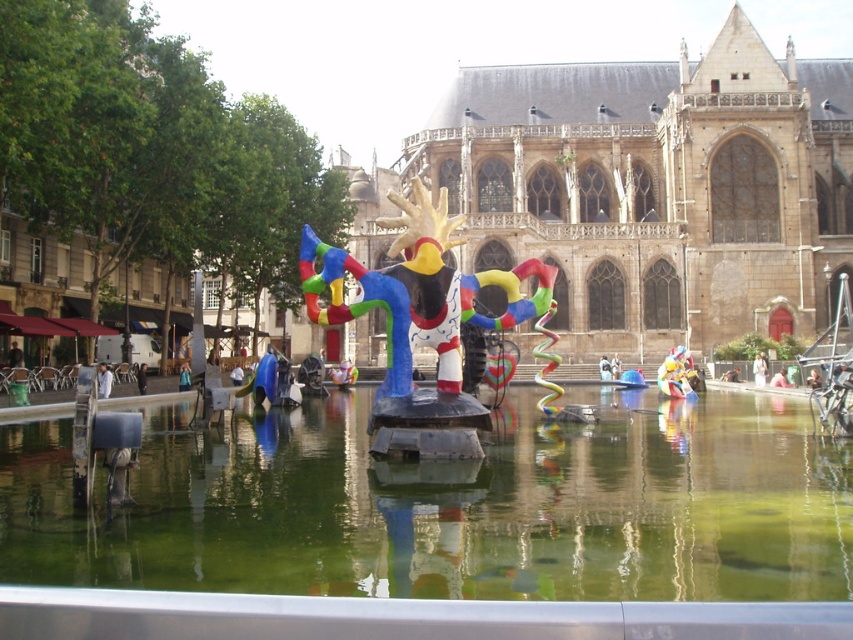
You are an artist planning to create a miniature version of the multicolored plastic sculpture at center and the multicolored plastic toy at center. If the toy is 10 cm tall, what should be the minimum height of the sculpture to maintain the correct proportions?

The multicolored plastic sculpture at center is bigger than the multicolored plastic toy at center. Since the toy is 10 cm tall, the sculpture must be taller than 10 cm to maintain the correct proportions.

You are standing at the edge of the water feature and want to take a photo of the brown stone cathedral at center. Where should you position yourself to ensure the cathedral is centered in your viewfinder?

Since the brown stone cathedral at center is located at point coordinates 0.295 on the x axis and 0.760 on the y axis, you should position yourself directly in front of the water feature at the point corresponding to these coordinates to center the cathedral in your viewfinder.

You are a city planner assessing the urban space. The brown stone cathedral at center and the multicolored plastic toy at center are both central to the design. If you need to place a new bench that must be equidistant from both, where would you position it?

The bench should be placed exactly halfway between the brown stone cathedral at center and the multicolored plastic toy at center since they are both at the center but the brown stone cathedral at center is wider. The midpoint between their centers would ensure equal distance from both objects.